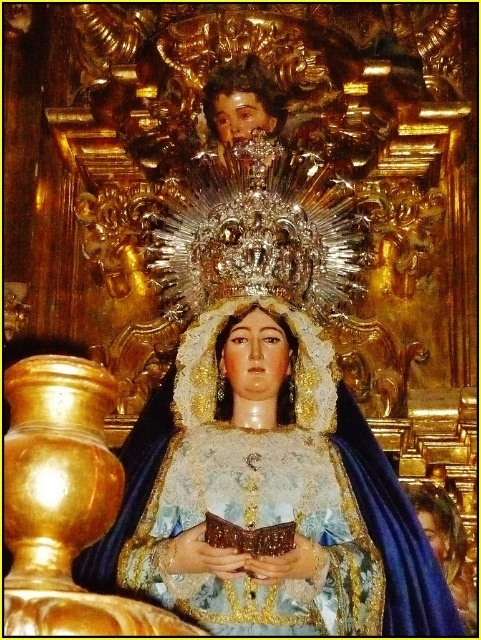
Question: Is matte blue fabric at center to the right of smooth golden hair at lower right from the viewer's perspective?

Choices:
 (A) no
 (B) yes

Answer: (A)

Question: Which point is closer to the camera?

Choices:
 (A) smooth golden hair at lower right
 (B) matte blue fabric at center

Answer: (B)

Question: Where is matte blue fabric at center located in relation to smooth golden hair at lower right in the image?

Choices:
 (A) left
 (B) right

Answer: (A)

Question: Among these points, which one is farthest from the camera?

Choices:
 (A) (305, 595)
 (B) (410, 497)

Answer: (B)

Question: Is matte blue fabric at center positioned at the back of smooth golden hair at lower right?

Choices:
 (A) yes
 (B) no

Answer: (B)

Question: Among these objects, which one is farthest from the camera?

Choices:
 (A) matte blue fabric at center
 (B) smooth golden hair at lower right

Answer: (B)